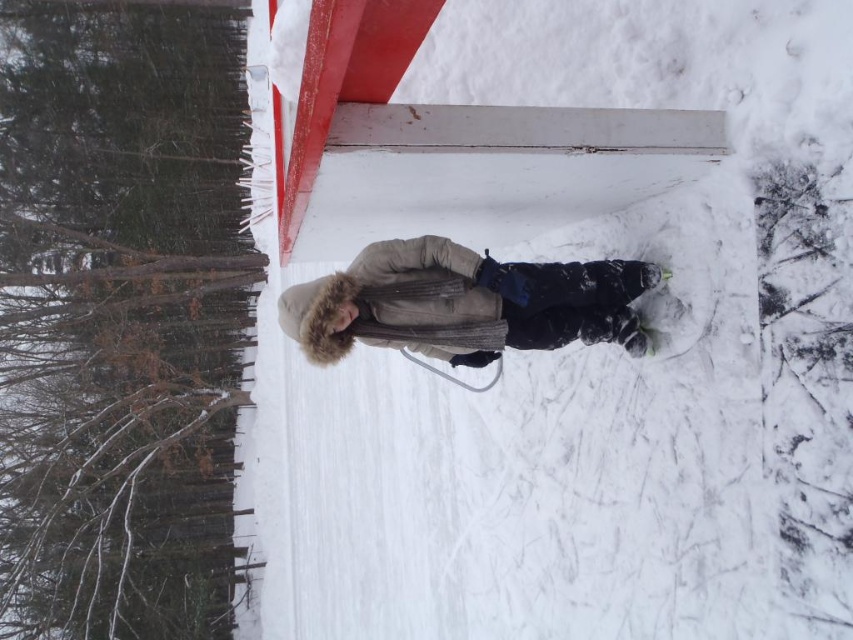
Who is more forward, [671,344] or [448,348]?

Positioned in front is point [448,348].

Find the location of a particular element. The height and width of the screenshot is (640, 853). white fluffy snow at center is located at coordinates (570, 344).

Find the location of a particular element. The width and height of the screenshot is (853, 640). white fluffy snow at center is located at coordinates (570, 344).

Find the location of `white fluffy snow at center`. white fluffy snow at center is located at coordinates (570, 344).